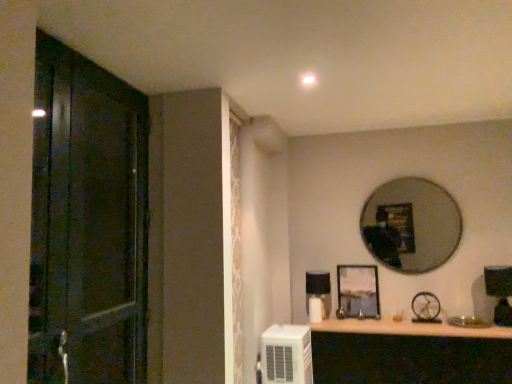
Locate an element on the screen. The width and height of the screenshot is (512, 384). metallic silver clock at upper right is located at coordinates (426, 307).

I want to click on dark wood door at left, so click(87, 223).

Image resolution: width=512 pixels, height=384 pixels. What do you see at coordinates (358, 292) in the screenshot?
I see `metallic silver picture frame at center` at bounding box center [358, 292].

At what (x,y) coordinates should I click in order to perform the action: click on silver metallic mirror at upper right. Please return your answer as a coordinate pair (x, y). Image resolution: width=512 pixels, height=384 pixels. Looking at the image, I should click on (411, 225).

The image size is (512, 384). I want to click on white plastic air conditioner at lower right, so click(x=286, y=355).

Locate an element on the screen. The height and width of the screenshot is (384, 512). metallic silver clock at upper right is located at coordinates (426, 307).

Is metallic silver picture frame at center turned away from white plastic air conditioner at lower right?

No, metallic silver picture frame at center's orientation is not away from white plastic air conditioner at lower right.

Which is behind, point (345, 316) or point (271, 364)?

The point (345, 316) is behind.

Is metallic silver picture frame at center not near white plastic air conditioner at lower right?

Actually, metallic silver picture frame at center and white plastic air conditioner at lower right are a little close together.

How much distance is there between metallic silver picture frame at center and wooden shelf at lower center?

metallic silver picture frame at center is 22.00 inches away from wooden shelf at lower center.

Could you tell me if metallic silver picture frame at center is facing wooden shelf at lower center?

No, metallic silver picture frame at center is not facing towards wooden shelf at lower center.

Is metallic silver picture frame at center bigger or smaller than wooden shelf at lower center?

Clearly, metallic silver picture frame at center is smaller in size than wooden shelf at lower center.

Considering the relative sizes of metallic silver picture frame at center and wooden shelf at lower center in the image provided, is metallic silver picture frame at center wider than wooden shelf at lower center?

Incorrect, the width of metallic silver picture frame at center does not surpass that of wooden shelf at lower center.

How much distance is there between silver metallic mirror at upper right and metallic silver picture frame at center?

They are 18.18 inches apart.

Which is behind, silver metallic mirror at upper right or metallic silver picture frame at center?

metallic silver picture frame at center.

From a real-world perspective, between silver metallic mirror at upper right and metallic silver picture frame at center, who is vertically lower?

From a 3D spatial view, metallic silver picture frame at center is below.

Based on the photo, can you confirm if silver metallic mirror at upper right is positioned to the left of metallic silver picture frame at center?

No, silver metallic mirror at upper right is not to the left of metallic silver picture frame at center.

From the picture: Which object is further away from the camera taking this photo, dark wood door at left or wooden shelf at lower center?

wooden shelf at lower center.

Consider the image. Would you say dark wood door at left contains wooden shelf at lower center?

No, dark wood door at left does not contain wooden shelf at lower center.

Does dark wood door at left appear on the left side of wooden shelf at lower center?

Indeed, dark wood door at left is positioned on the left side of wooden shelf at lower center.

Considering the sizes of objects dark wood door at left and wooden shelf at lower center in the image provided, who is smaller, dark wood door at left or wooden shelf at lower center?

dark wood door at left is smaller.

Is metallic silver picture frame at center directly adjacent to metallic silver clock at upper right?

No, metallic silver picture frame at center is not with metallic silver clock at upper right.

Is metallic silver picture frame at center oriented towards metallic silver clock at upper right?

No, metallic silver picture frame at center is not aimed at metallic silver clock at upper right.

In the scene shown: How many degrees apart are the facing directions of metallic silver picture frame at center and metallic silver clock at upper right?

The facing directions of metallic silver picture frame at center and metallic silver clock at upper right are 0.0113 degrees apart.

How much distance is there between metallic silver picture frame at center and metallic silver clock at upper right?

metallic silver picture frame at center is 17.07 inches from metallic silver clock at upper right.

Would you say silver metallic mirror at upper right is outside dark wood door at left?

silver metallic mirror at upper right is positioned outside dark wood door at left.

Considering the positions of point (412, 205) and point (59, 234), is point (412, 205) closer or farther from the camera than point (59, 234)?

Point (412, 205) appears to be farther away from the viewer than point (59, 234).

This screenshot has width=512, height=384. Find the location of `mirror lying below the dark wood door at left (from the image's perspective)`. mirror lying below the dark wood door at left (from the image's perspective) is located at coordinates (411, 225).

Between silver metallic mirror at upper right and metallic silver clock at upper right, which one is positioned in front?

metallic silver clock at upper right is closer to the camera.

This screenshot has width=512, height=384. Identify the location of mirror lying behind the metallic silver clock at upper right. (411, 225).

From a real-world perspective, is silver metallic mirror at upper right located beneath metallic silver clock at upper right?

No.

Is silver metallic mirror at upper right positioned with its back to metallic silver clock at upper right?

No.

At what (x,y) coordinates should I click in order to perform the action: click on air conditioner on the left of metallic silver picture frame at center. Please return your answer as a coordinate pair (x, y). This screenshot has height=384, width=512. Looking at the image, I should click on (286, 355).

The height and width of the screenshot is (384, 512). I want to click on cabinetry that is on the right side of metallic silver picture frame at center, so click(409, 359).

From the image, which object appears to be farther from dark wood door at left, silver metallic mirror at upper right or metallic silver clock at upper right?

The object further to dark wood door at left is metallic silver clock at upper right.

Based on their spatial positions, is metallic silver clock at upper right or wooden shelf at lower center further from dark wood door at left?

metallic silver clock at upper right is further to dark wood door at left.

Looking at the image, which one is located further to dark wood door at left, metallic silver clock at upper right or metallic silver picture frame at center?

Among the two, metallic silver clock at upper right is located further to dark wood door at left.

Looking at the image, which one is located closer to white plastic air conditioner at lower right, metallic silver picture frame at center or dark wood door at left?

metallic silver picture frame at center is closer to white plastic air conditioner at lower right.

Considering their positions, is wooden shelf at lower center positioned closer to metallic silver clock at upper right than silver metallic mirror at upper right?

Among the two, silver metallic mirror at upper right is located nearer to metallic silver clock at upper right.

From the image, which object appears to be farther from metallic silver picture frame at center, white plastic air conditioner at lower right or silver metallic mirror at upper right?

white plastic air conditioner at lower right lies further to metallic silver picture frame at center than the other object.

Estimate the real-world distances between objects in this image. Which object is closer to wooden shelf at lower center, silver metallic mirror at upper right or metallic silver clock at upper right?

metallic silver clock at upper right.

Considering their positions, is white plastic air conditioner at lower right positioned closer to silver metallic mirror at upper right than dark wood door at left?

white plastic air conditioner at lower right.

Where is `picture frame between silver metallic mirror at upper right and wooden shelf at lower center in the vertical direction`? picture frame between silver metallic mirror at upper right and wooden shelf at lower center in the vertical direction is located at coordinates [x=358, y=292].

Locate an element on the screen. air conditioner situated between dark wood door at left and metallic silver clock at upper right from left to right is located at coordinates (286, 355).

Identify the location of picture frame between silver metallic mirror at upper right and metallic silver clock at upper right vertically. The width and height of the screenshot is (512, 384). [x=358, y=292].

Locate an element on the screen. Image resolution: width=512 pixels, height=384 pixels. mirror between dark wood door at left and metallic silver picture frame at center along the z-axis is located at coordinates (411, 225).